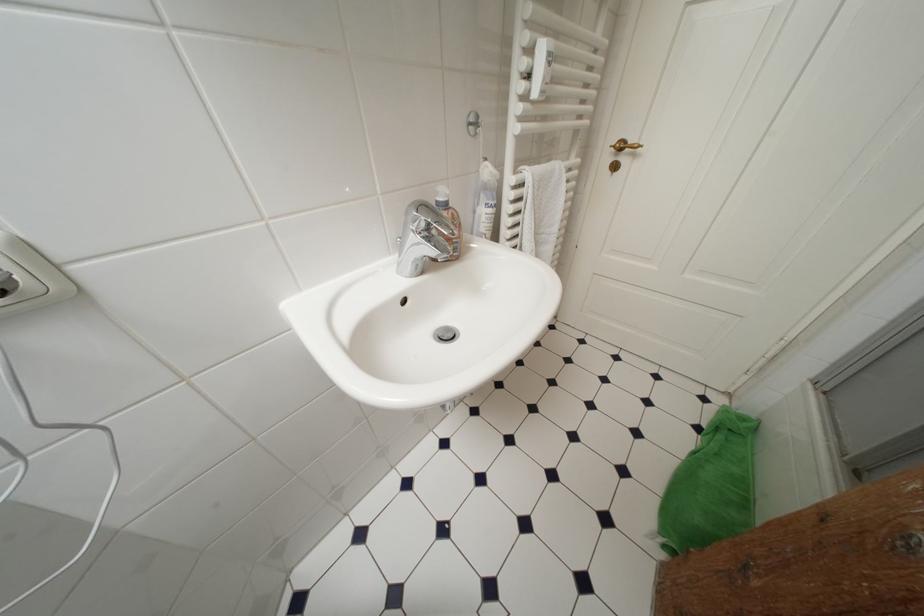
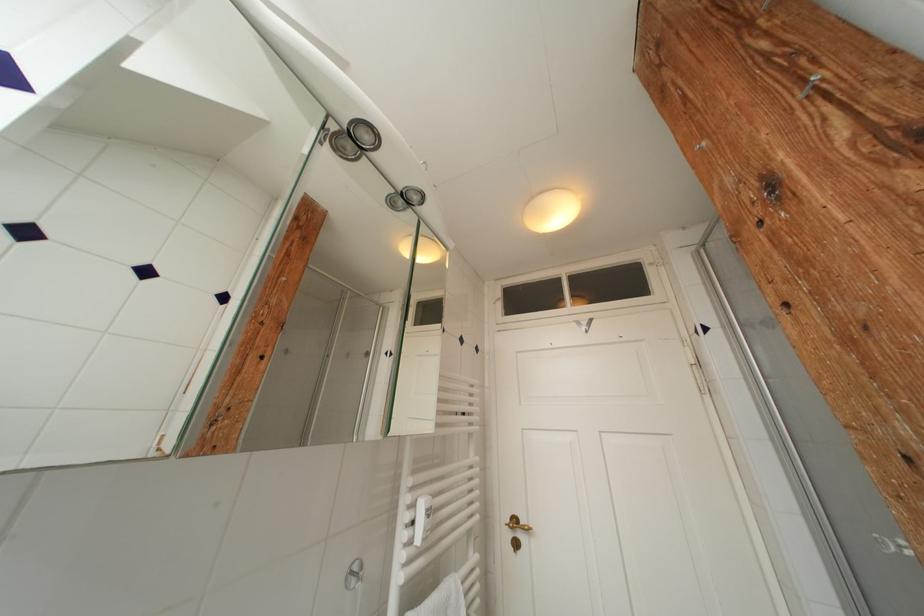
Where in the second image is the point corresponding to pixel 616 161 from the first image?

(516, 539)